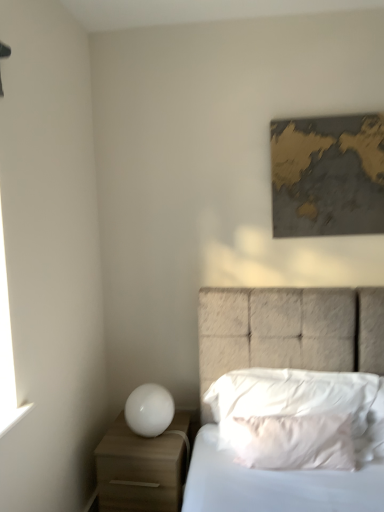
Question: Is white glossy sphere at lower left in front of or behind textured fabric bed at center in the image?

Choices:
 (A) behind
 (B) front

Answer: (A)

Question: Would you say white glossy sphere at lower left is to the left or to the right of textured fabric bed at center in the picture?

Choices:
 (A) left
 (B) right

Answer: (A)

Question: Which is farther from the white soft pillow at center, placed as the first pillow when sorted from front to back?

Choices:
 (A) textured fabric bed at center
 (B) white glossy sphere at lower left
 (C) gold metallic map at upper right
 (D) white matte nightstand at lower left
 (E) white soft pillow at center, the 1th pillow in the back-to-front sequence

Answer: (C)

Question: Considering the real-world distances, which object is closest to the textured fabric bed at center?

Choices:
 (A) white matte nightstand at lower left
 (B) gold metallic map at upper right
 (C) white soft pillow at center, the 2th pillow positioned from the back
 (D) white glossy sphere at lower left
 (E) white soft pillow at center, placed as the 2th pillow when sorted from front to back

Answer: (E)